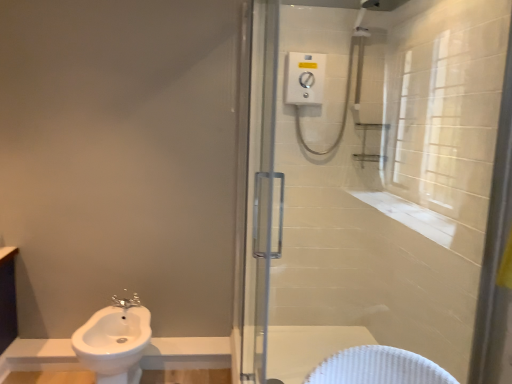
Question: Is satin nickel faucet at lower left in front of or behind white glossy sink at lower left in the image?

Choices:
 (A) front
 (B) behind

Answer: (B)

Question: Choose the correct answer: Is satin nickel faucet at lower left inside white glossy sink at lower left or outside it?

Choices:
 (A) inside
 (B) outside

Answer: (A)

Question: Which object is the farthest from the white glossy sink at lower left?

Choices:
 (A) satin nickel faucet at lower left
 (B) clear glass shower door at center

Answer: (B)

Question: Which object is positioned closest to the clear glass shower door at center?

Choices:
 (A) satin nickel faucet at lower left
 (B) white glossy sink at lower left

Answer: (B)